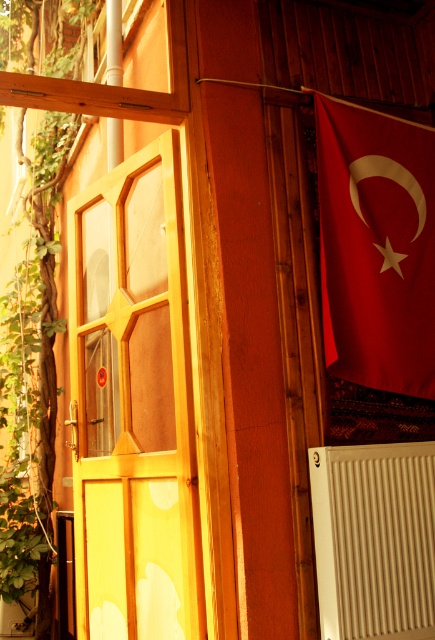
Does wooden door at left have a lesser height compared to red matte flag at upper right?

Incorrect, wooden door at left's height does not fall short of red matte flag at upper right's.

Between wooden door at left and red matte flag at upper right, which one is positioned lower?

wooden door at left

Where is `wooden door at left`? Image resolution: width=435 pixels, height=640 pixels. wooden door at left is located at coordinates pos(133,404).

Based on the photo, is wooden door at left closer to the viewer compared to white ribbed radiator at lower right?

That is False.

Between wooden door at left and white ribbed radiator at lower right, which one has less height?

white ribbed radiator at lower right is shorter.

You are a GUI agent. You are given a task and a screenshot of the screen. Output one action in this format:
    pyautogui.click(x=<x>, y=<y>)
    Task: Click on the wooden door at left
    Image resolution: width=435 pixels, height=640 pixels.
    Given the screenshot: What is the action you would take?
    pyautogui.click(x=133, y=404)

Is the position of red matte flag at upper right more distant than that of white ribbed radiator at lower right?

Yes, it is.

Which is more to the right, red matte flag at upper right or white ribbed radiator at lower right?

From the viewer's perspective, red matte flag at upper right appears more on the right side.

Does point (411, 202) come farther from viewer compared to point (343, 461)?

That is True.

In order to click on red matte flag at upper right in this screenshot , I will do `click(375, 246)`.